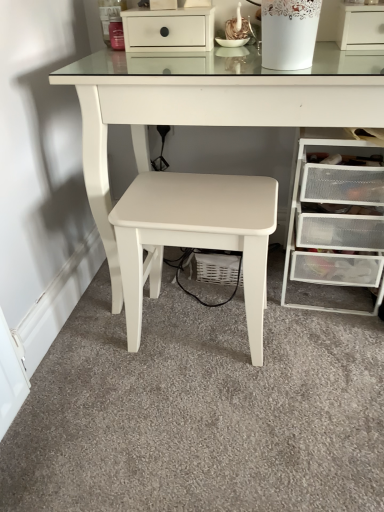
Identify the location of free space above white matte drawer at upper center, positioned as the first chest of drawers in top-to-bottom order (from a real-world perspective). (166, 3).